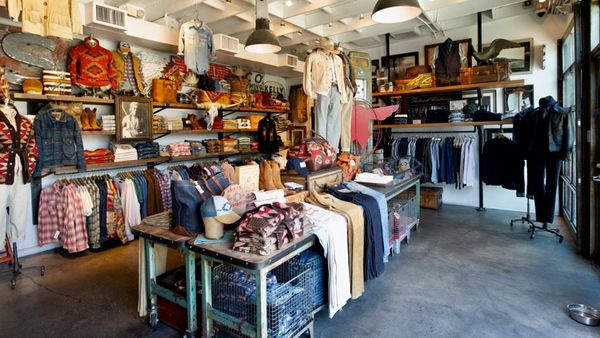
Locate an element on the screen. Image resolution: width=600 pixels, height=338 pixels. table is located at coordinates (168, 234).